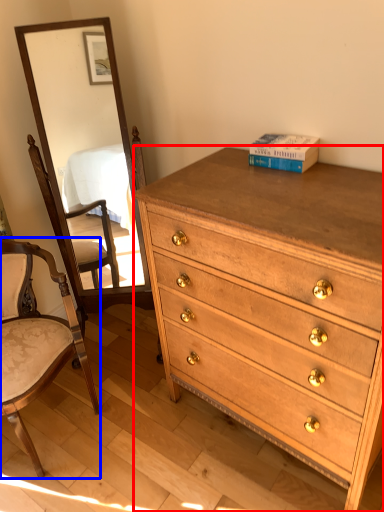
Question: Which point is closer to the camera, chest of drawers (highlighted by a red box) or chair (highlighted by a blue box)?

Choices:
 (A) chest of drawers
 (B) chair

Answer: (A)